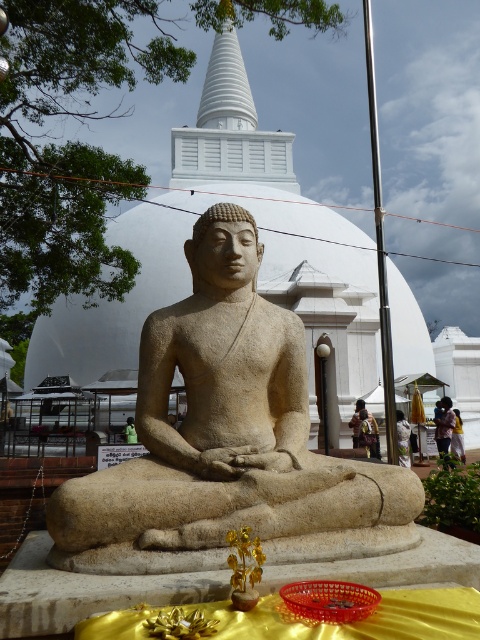
Question: Which point is farther to the camera?

Choices:
 (A) (455, 429)
 (B) (441, 435)
 (C) (229, 33)

Answer: (C)

Question: From the image, what is the correct spatial relationship of beige stone statue at center in relation to light brown fabric at lower right?

Choices:
 (A) right
 (B) left

Answer: (B)

Question: Does white stupa at upper center appear under light brown fabric at lower right?

Choices:
 (A) no
 (B) yes

Answer: (A)

Question: Which of these objects is positioned closest to the beige stone statue at center?

Choices:
 (A) yellow fabric dress at center
 (B) yellow fabric at center

Answer: (A)

Question: Which of these objects is positioned closest to the yellow fabric at lower center?

Choices:
 (A) yellow fabric at center
 (B) light brown fabric at lower right

Answer: (B)

Question: Does yellow fabric at lower center appear on the left side of yellow fabric at center?

Choices:
 (A) no
 (B) yes

Answer: (A)